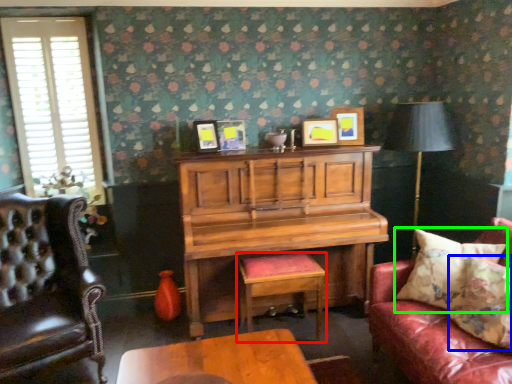
Question: Which object is positioned farthest from stool (highlighted by a red box)? Select from pillow (highlighted by a blue box) and pillow (highlighted by a green box).

Choices:
 (A) pillow
 (B) pillow

Answer: (A)